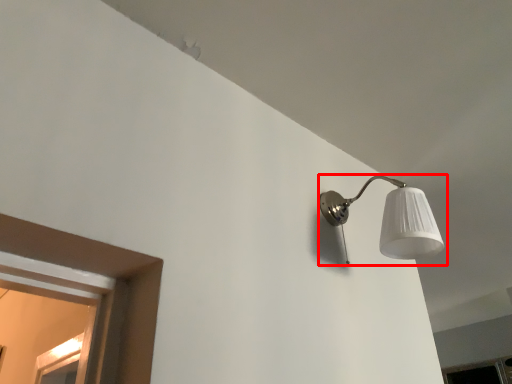
Question: From the image's perspective, what is the correct spatial relationship of lamp (annotated by the red box) in relation to window?

Choices:
 (A) above
 (B) below

Answer: (A)